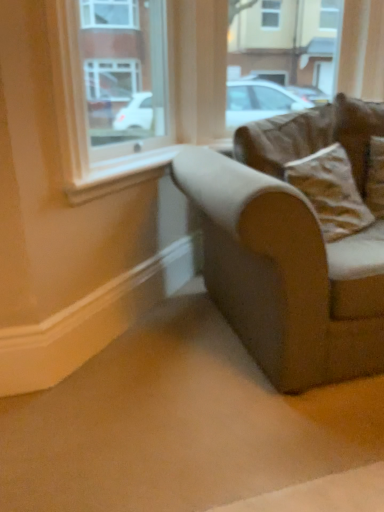
Question: Would you say brown fabric couch at right is to the left or to the right of brown fabric pillow at right, which appears as the second pillow when viewed from the top, in the picture?

Choices:
 (A) right
 (B) left

Answer: (A)

Question: Is brown fabric couch at right in front of or behind brown fabric pillow at right, which appears as the second pillow when viewed from the top, in the image?

Choices:
 (A) front
 (B) behind

Answer: (A)

Question: Considering the real-world distances, which object is farthest from the brown fabric couch at right?

Choices:
 (A) brown suede pillow at upper right, which is counted as the 1th pillow, starting from the top
 (B) clear glass window at upper left
 (C) brown fabric pillow at right, which is the 1th pillow in bottom-to-top order

Answer: (B)

Question: Estimate the real-world distances between objects in this image. Which object is farther from the brown fabric couch at right?

Choices:
 (A) brown suede pillow at upper right, marked as the second pillow in a bottom-to-top arrangement
 (B) clear glass window at upper left
 (C) brown fabric pillow at right, which appears as the second pillow when viewed from the top

Answer: (B)